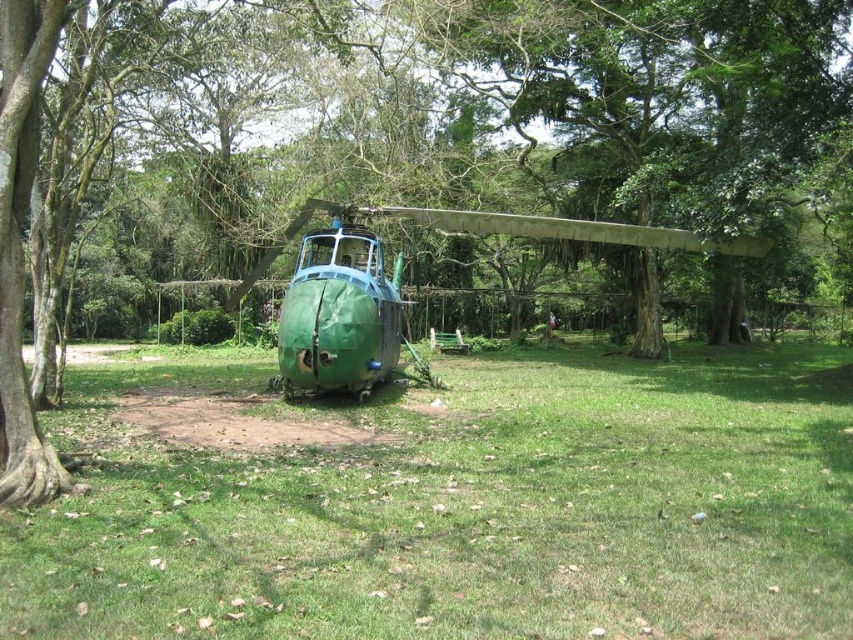
You are a drone operator trying to land a small drone in this scene. You need to choose between landing on the green grass at center or the green matte helicopter at center. Which surface is shorter and safer for landing?

The green grass at center is not as tall as the green matte helicopter at center, so the green grass at center is shorter and safer for landing.

You are a maintenance worker needing to reach the green matte helicopter at center. You have a 3 meter long ladder. If you place the ladder at the green grass at center, will it reach the helicopter?

The green grass at center is 2.79 meters from the green matte helicopter at center. Since the ladder is 3 meters long, which is longer than the distance, placing it at the green grass at center will allow you to reach the helicopter.